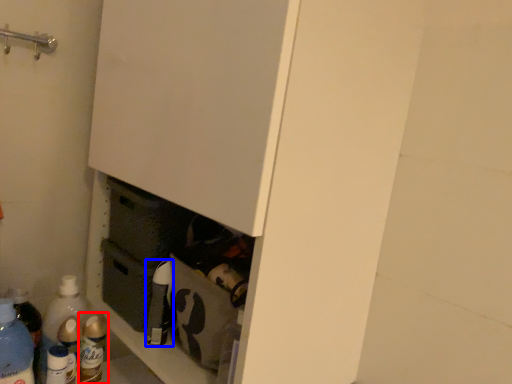
Question: Which point is further to the camera, bottle (highlighted by a red box) or bottle (highlighted by a blue box)?

Choices:
 (A) bottle
 (B) bottle

Answer: (A)